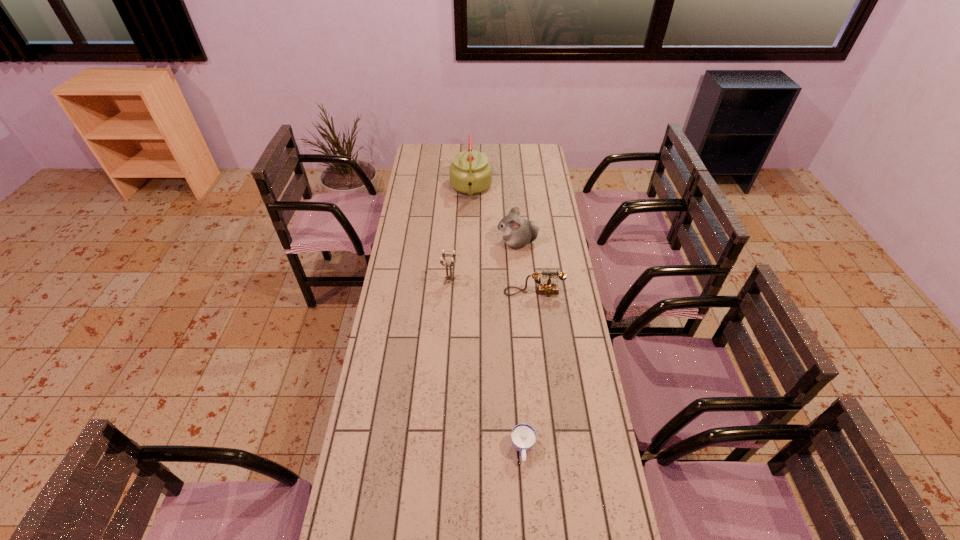
The height and width of the screenshot is (540, 960). I want to click on the tallest object, so click(x=470, y=173).

You are a GUI agent. You are given a task and a screenshot of the screen. Output one action in this format:
    pyautogui.click(x=<x>, y=<y>)
    Task: Click on the kettle
    The height and width of the screenshot is (540, 960).
    Given the screenshot: What is the action you would take?
    pyautogui.click(x=470, y=173)

Where is `hamster`? hamster is located at coordinates (517, 232).

Where is `the third nearest object`? Image resolution: width=960 pixels, height=540 pixels. the third nearest object is located at coordinates (x=449, y=277).

Identify the location of telephone. Image resolution: width=960 pixels, height=540 pixels. (548, 288).

The image size is (960, 540). Identify the location of the second nearest object. (548, 288).

The image size is (960, 540). Find the location of `the nearest object`. the nearest object is located at coordinates (523, 436).

The width and height of the screenshot is (960, 540). Find the location of `the shortest object`. the shortest object is located at coordinates (523, 436).

Locate an element on the screen. The width and height of the screenshot is (960, 540). free space located at the spout of the kettle is located at coordinates (469, 256).

This screenshot has height=540, width=960. Find the location of `vacant space situated on the face of the hamster`. vacant space situated on the face of the hamster is located at coordinates (413, 242).